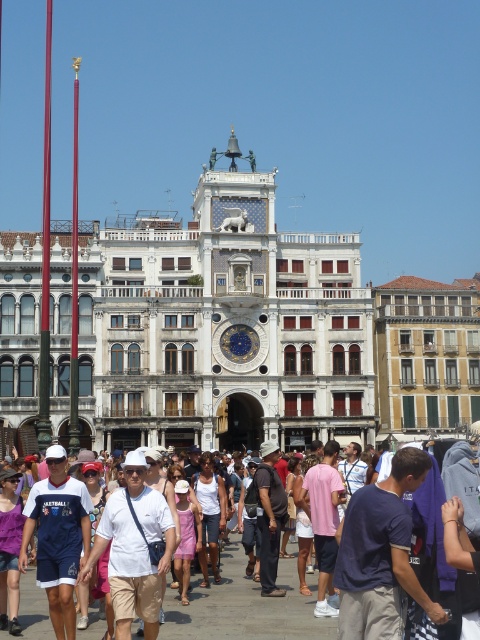
Question: Estimate the real-world distances between objects in this image. Which object is farther from the matte white shirt at lower left?

Choices:
 (A) white cotton crowd at center
 (B) white cotton tank top at center

Answer: (B)

Question: Does matte white shirt at lower left have a lesser width compared to pink fabric dress at center?

Choices:
 (A) no
 (B) yes

Answer: (A)

Question: Which point is farther to the camera?

Choices:
 (A) (143, 516)
 (B) (215, 570)
 (C) (331, 579)
 (D) (0, 602)

Answer: (B)

Question: Is white cotton shirt at center positioned behind white cotton tank top at center?

Choices:
 (A) no
 (B) yes

Answer: (A)

Question: Is white cotton shirt at center below pink cotton shirt at center?

Choices:
 (A) no
 (B) yes

Answer: (A)

Question: Which of the following is the closest to the observer?

Choices:
 (A) white cotton shirt at center
 (B) white cotton tank top at center

Answer: (A)